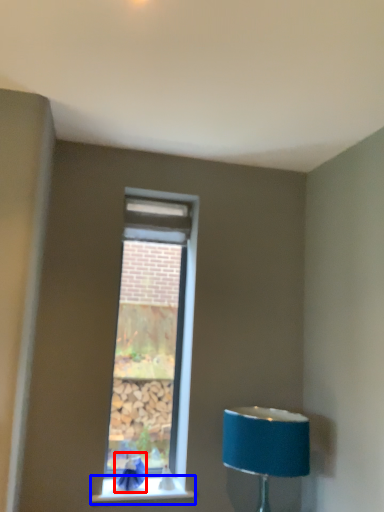
Question: Which point is closer to the camera, swivel chair (highlighted by a red box) or window sill (highlighted by a blue box)?

Choices:
 (A) swivel chair
 (B) window sill

Answer: (B)